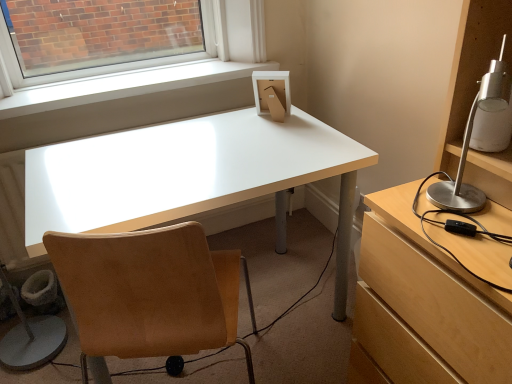
Question: Is tan suede chair at center wider than silver metallic lamp at right?

Choices:
 (A) no
 (B) yes

Answer: (B)

Question: Can you confirm if tan suede chair at center is bigger than silver metallic lamp at right?

Choices:
 (A) no
 (B) yes

Answer: (B)

Question: From the image's perspective, is tan suede chair at center under silver metallic lamp at right?

Choices:
 (A) yes
 (B) no

Answer: (A)

Question: Are tan suede chair at center and silver metallic lamp at right far apart?

Choices:
 (A) no
 (B) yes

Answer: (A)

Question: From a real-world perspective, is tan suede chair at center on silver metallic lamp at right?

Choices:
 (A) yes
 (B) no

Answer: (B)

Question: From a real-world perspective, is white glossy desk at center positioned above or below tan suede chair at center?

Choices:
 (A) below
 (B) above

Answer: (A)

Question: Does point (340, 193) appear closer or farther from the camera than point (119, 284)?

Choices:
 (A) closer
 (B) farther

Answer: (B)

Question: Looking at the image, does white glossy desk at center seem bigger or smaller compared to tan suede chair at center?

Choices:
 (A) big
 (B) small

Answer: (A)

Question: Is white glossy desk at center spatially inside tan suede chair at center, or outside of it?

Choices:
 (A) outside
 (B) inside

Answer: (A)

Question: Is white smooth window sill at upper center taller or shorter than white glossy desk at center?

Choices:
 (A) short
 (B) tall

Answer: (A)

Question: Which is correct: white smooth window sill at upper center is inside white glossy desk at center, or outside of it?

Choices:
 (A) outside
 (B) inside

Answer: (A)

Question: Looking at the image, does white smooth window sill at upper center seem bigger or smaller compared to white glossy desk at center?

Choices:
 (A) small
 (B) big

Answer: (A)

Question: From a real-world perspective, is white smooth window sill at upper center positioned above or below white glossy desk at center?

Choices:
 (A) above
 (B) below

Answer: (A)

Question: Considering the positions of white glossy desk at center and silver metallic lamp at right in the image, is white glossy desk at center wider or thinner than silver metallic lamp at right?

Choices:
 (A) thin
 (B) wide

Answer: (B)

Question: Relative to silver metallic lamp at right, is white glossy desk at center in front or behind?

Choices:
 (A) front
 (B) behind

Answer: (B)